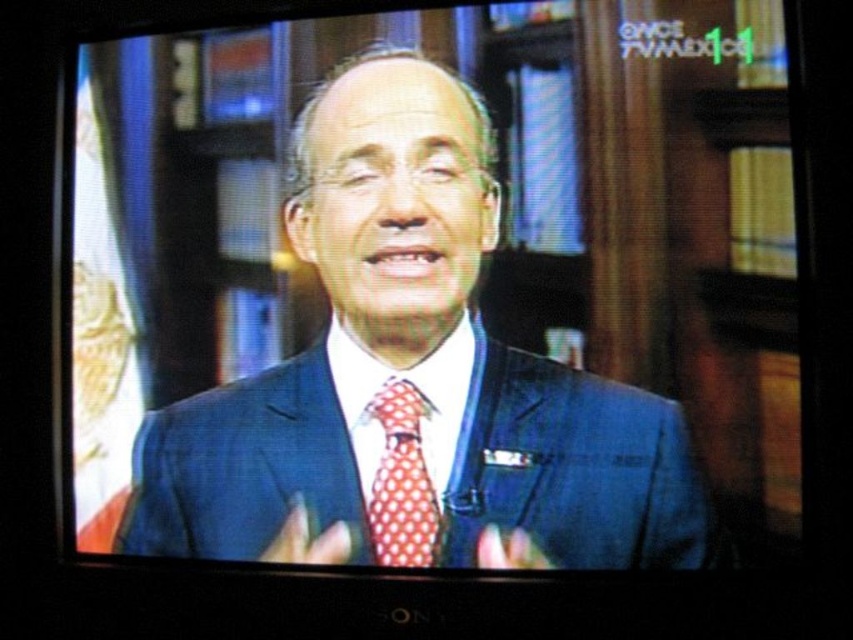
Does blue textured suit at center lie in front of polka dot silk tie at center?

A: Yes, it is in front of polka dot silk tie at center.

Measure the distance from blue textured suit at center to polka dot silk tie at center.

blue textured suit at center and polka dot silk tie at center are 4.62 inches apart.

The image size is (853, 640). Find the location of `blue textured suit at center`. blue textured suit at center is located at coordinates (573, 467).

Image resolution: width=853 pixels, height=640 pixels. I want to click on blue textured suit at center, so click(x=573, y=467).

Is blue suit at center positioned in front of polka dot silk tie at center?

Yes, blue suit at center is closer to the viewer.

Which is behind, point (149, 461) or point (399, 557)?

Point (149, 461)

At what (x,y) coordinates should I click in order to perform the action: click on blue suit at center. Please return your answer as a coordinate pair (x, y). Looking at the image, I should click on (412, 374).

Consider the image. Does blue suit at center appear on the right side of blue textured suit at center?

In fact, blue suit at center is to the left of blue textured suit at center.

Who is more forward, (457, 512) or (321, 412)?

Positioned in front is point (457, 512).

You are a GUI agent. You are given a task and a screenshot of the screen. Output one action in this format:
    pyautogui.click(x=<x>, y=<y>)
    Task: Click on the blue suit at center
    
    Given the screenshot: What is the action you would take?
    pyautogui.click(x=412, y=374)